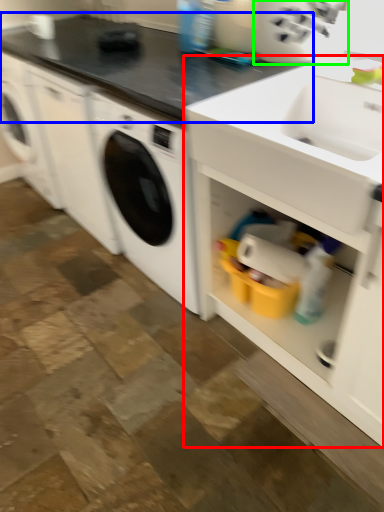
Question: Which object is positioned farthest from cabinetry (highlighted by a red box)? Select from countertop (highlighted by a blue box) and appliance (highlighted by a green box).

Choices:
 (A) countertop
 (B) appliance

Answer: (A)